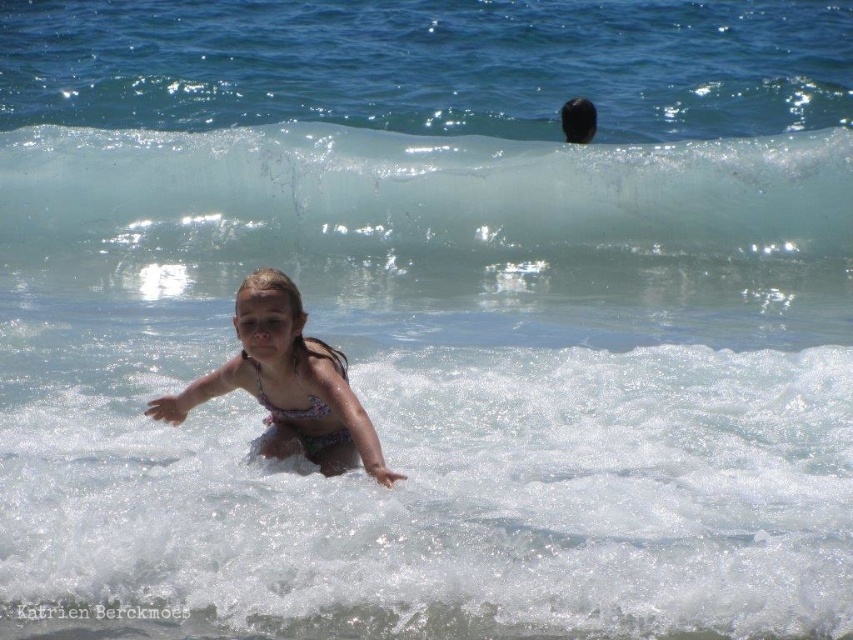
I want to click on clear glass wave at upper center, so click(425, 189).

Can you confirm if clear glass wave at upper center is smaller than multicolored bikini at center?

Incorrect, clear glass wave at upper center is not smaller in size than multicolored bikini at center.

Is point (21, 234) in front of point (328, 349)?

No, (21, 234) is further to viewer.

This screenshot has height=640, width=853. Identify the location of clear glass wave at upper center. (425, 189).